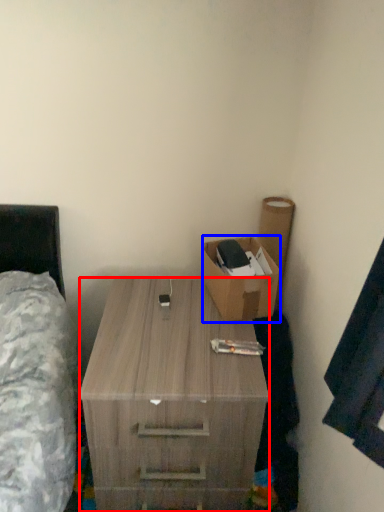
Question: Which point is closer to the camera, desk (highlighted by a red box) or box (highlighted by a blue box)?

Choices:
 (A) desk
 (B) box

Answer: (A)